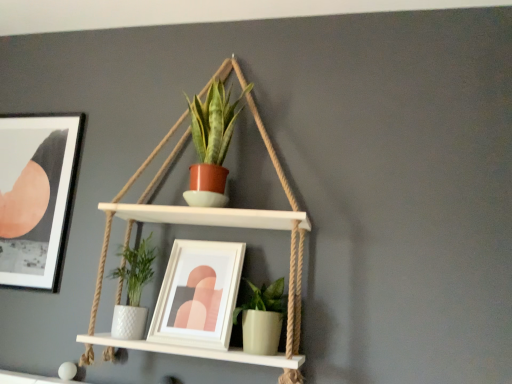
This screenshot has width=512, height=384. What are the coordinates of `matte terracotta pot at center, placed as the 2th houseplant when sorted from bottom to top` in the screenshot? It's located at (211, 145).

You are a GUI agent. You are given a task and a screenshot of the screen. Output one action in this format:
    pyautogui.click(x=<x>, y=<y>)
    Task: Click on the white matte picture frame at center, which is counted as the first picture frame, starting from the right
    Image resolution: width=512 pixels, height=384 pixels.
    Given the screenshot: What is the action you would take?
    pyautogui.click(x=198, y=294)

Is white matte picture frame at center, the second picture frame from the left, facing away from matte terracotta pot at center, the 1th houseplant in the top-to-bottom sequence?

No, white matte picture frame at center, the second picture frame from the left, is not facing the opposite direction of matte terracotta pot at center, the 1th houseplant in the top-to-bottom sequence.

From the image's perspective, does white matte picture frame at center, which is counted as the 1th picture frame, starting from the front, appear lower than matte terracotta pot at center, the 1th houseplant in the top-to-bottom sequence?

Indeed, from the image's perspective, white matte picture frame at center, which is counted as the 1th picture frame, starting from the front, is shown beneath matte terracotta pot at center, the 1th houseplant in the top-to-bottom sequence.

Considering the relative sizes of white matte picture frame at center, the second picture frame from the left, and matte terracotta pot at center, the 1th houseplant in the top-to-bottom sequence, in the image provided, is white matte picture frame at center, the second picture frame from the left, wider than matte terracotta pot at center, the 1th houseplant in the top-to-bottom sequence,?

Yes, white matte picture frame at center, the second picture frame from the left, is wider than matte terracotta pot at center, the 1th houseplant in the top-to-bottom sequence.

From a real-world perspective, between white matte picture frame at center, the second picture frame from the left, and matte terracotta pot at center, the 1th houseplant in the top-to-bottom sequence, who is vertically lower?

From a 3D spatial view, white matte picture frame at center, the second picture frame from the left, is below.

Does green matte pot at lower center, the second houseplant viewed from the top, have a lesser width compared to white matte picture frame at center, the second picture frame from the left?

Yes, green matte pot at lower center, the second houseplant viewed from the top, is thinner than white matte picture frame at center, the second picture frame from the left.

From the image's perspective, is green matte pot at lower center, the second houseplant viewed from the top, above white matte picture frame at center, marked as the second picture frame in a back-to-front arrangement?

No, from the image's perspective, green matte pot at lower center, the second houseplant viewed from the top, is not above white matte picture frame at center, marked as the second picture frame in a back-to-front arrangement.

How many degrees apart are the facing directions of green matte pot at lower center, which ranks as the 1th houseplant in bottom-to-top order, and white matte picture frame at center, which is counted as the first picture frame, starting from the right?

They differ by 0.127 degrees in their facing directions.

Is green matte pot at lower center, the second houseplant viewed from the top, not near white matte picture frame at center, which is counted as the 1th picture frame, starting from the front?

green matte pot at lower center, the second houseplant viewed from the top, is actually quite close to white matte picture frame at center, which is counted as the 1th picture frame, starting from the front.

Can you tell me how much white matte picture frame at center, the second picture frame from the left, and matte black picture frame at upper left, placed as the second picture frame when sorted from front to back, differ in facing direction?

1.1 degrees separate the facing orientations of white matte picture frame at center, the second picture frame from the left, and matte black picture frame at upper left, placed as the second picture frame when sorted from front to back.

Which is further, (x=226, y=331) or (x=47, y=200)?

The point (x=47, y=200) is farther.

Is white matte picture frame at center, marked as the second picture frame in a back-to-front arrangement, not near matte black picture frame at upper left, acting as the 1th picture frame starting from the back?

That's not correct — white matte picture frame at center, marked as the second picture frame in a back-to-front arrangement, is a little close to matte black picture frame at upper left, acting as the 1th picture frame starting from the back.

Is white matte picture frame at center, the second picture frame from the left, wider than matte black picture frame at upper left, acting as the 1th picture frame starting from the back?

Correct, the width of white matte picture frame at center, the second picture frame from the left, exceeds that of matte black picture frame at upper left, acting as the 1th picture frame starting from the back.

How many degrees apart are the facing directions of matte terracotta pot at center, placed as the 2th houseplant when sorted from bottom to top, and white matte picture frame at center, marked as the second picture frame in a back-to-front arrangement?

0.482 degrees.

From the image's perspective, is matte terracotta pot at center, the 1th houseplant in the top-to-bottom sequence, under white matte picture frame at center, the second picture frame from the left?

No, from the image's perspective, matte terracotta pot at center, the 1th houseplant in the top-to-bottom sequence, is not below white matte picture frame at center, the second picture frame from the left.

Looking at this image, which point is more distant from viewer, (x=193, y=139) or (x=191, y=323)?

Positioned behind is point (x=193, y=139).

Does matte terracotta pot at center, the 1th houseplant in the top-to-bottom sequence, contain white matte picture frame at center, marked as the second picture frame in a back-to-front arrangement?

No, matte terracotta pot at center, the 1th houseplant in the top-to-bottom sequence, does not contain white matte picture frame at center, marked as the second picture frame in a back-to-front arrangement.

Between matte black picture frame at upper left, acting as the 1th picture frame starting from the back, and white matte picture frame at center, marked as the second picture frame in a back-to-front arrangement, which one is positioned behind?

matte black picture frame at upper left, acting as the 1th picture frame starting from the back, is more distant.

Based on the photo, measure the distance from matte black picture frame at upper left, acting as the 1th picture frame starting from the back, to white matte picture frame at center, which is counted as the first picture frame, starting from the right.

25.82 inches.

Looking at this image, which is closer to the camera, (x=39, y=263) or (x=164, y=315)?

Point (x=39, y=263) is positioned farther from the camera compared to point (x=164, y=315).

Between matte black picture frame at upper left, acting as the 1th picture frame starting from the back, and white matte picture frame at center, marked as the second picture frame in a back-to-front arrangement, which one has smaller width?

With smaller width is matte black picture frame at upper left, acting as the 1th picture frame starting from the back.

Would you say matte black picture frame at upper left, placed as the second picture frame when sorted from front to back, is inside or outside matte terracotta pot at center, placed as the 2th houseplant when sorted from bottom to top?

matte black picture frame at upper left, placed as the second picture frame when sorted from front to back, is spatially situated outside matte terracotta pot at center, placed as the 2th houseplant when sorted from bottom to top.

Does matte black picture frame at upper left, acting as the 1th picture frame starting from the back, appear on the right side of matte terracotta pot at center, the 1th houseplant in the top-to-bottom sequence?

Incorrect, matte black picture frame at upper left, acting as the 1th picture frame starting from the back, is not on the right side of matte terracotta pot at center, the 1th houseplant in the top-to-bottom sequence.

Considering the relative positions of matte black picture frame at upper left, which ranks as the 1th picture frame in left-to-right order, and matte terracotta pot at center, placed as the 2th houseplant when sorted from bottom to top, in the image provided, is matte black picture frame at upper left, which ranks as the 1th picture frame in left-to-right order, behind matte terracotta pot at center, placed as the 2th houseplant when sorted from bottom to top,?

Yes, matte black picture frame at upper left, which ranks as the 1th picture frame in left-to-right order, is further from the viewer.

Is the surface of green matte pot at lower center, which ranks as the 1th houseplant in bottom-to-top order, in direct contact with matte terracotta pot at center, the 1th houseplant in the top-to-bottom sequence?

No, green matte pot at lower center, which ranks as the 1th houseplant in bottom-to-top order, is not with matte terracotta pot at center, the 1th houseplant in the top-to-bottom sequence.

Would you say green matte pot at lower center, the second houseplant viewed from the top, is outside matte terracotta pot at center, the 1th houseplant in the top-to-bottom sequence?

Yes, green matte pot at lower center, the second houseplant viewed from the top, is not within matte terracotta pot at center, the 1th houseplant in the top-to-bottom sequence.

How distant is green matte pot at lower center, which ranks as the 1th houseplant in bottom-to-top order, from matte terracotta pot at center, the 1th houseplant in the top-to-bottom sequence?

The distance of green matte pot at lower center, which ranks as the 1th houseplant in bottom-to-top order, from matte terracotta pot at center, the 1th houseplant in the top-to-bottom sequence, is 17.99 inches.

Which picture frame is the 1st one when counting from the left side of the matte terracotta pot at center, placed as the 2th houseplant when sorted from bottom to top? Please provide its 2D coordinates.

[(198, 294)]

Find the location of `houseplant that appears in front of the white matte picture frame at center, the second picture frame from the left`. houseplant that appears in front of the white matte picture frame at center, the second picture frame from the left is located at coordinates (262, 317).

Which object lies nearer to the anchor point white matte picture frame at center, which is counted as the 1th picture frame, starting from the front, matte black picture frame at upper left, placed as the second picture frame when sorted from front to back, or matte terracotta pot at center, placed as the 2th houseplant when sorted from bottom to top?

Based on the image, matte terracotta pot at center, placed as the 2th houseplant when sorted from bottom to top, appears to be nearer to white matte picture frame at center, which is counted as the 1th picture frame, starting from the front.

From the image, which object appears to be farther from green matte pot at lower center, which ranks as the 1th houseplant in bottom-to-top order, white matte picture frame at center, the second picture frame from the left, or matte black picture frame at upper left, which is the 2th picture frame in right-to-left order?

matte black picture frame at upper left, which is the 2th picture frame in right-to-left order, is positioned further to the anchor green matte pot at lower center, which ranks as the 1th houseplant in bottom-to-top order.

Looking at the image, which one is located further to green matte pot at lower center, which ranks as the 1th houseplant in bottom-to-top order, matte terracotta pot at center, placed as the 2th houseplant when sorted from bottom to top, or white matte picture frame at center, which is counted as the 1th picture frame, starting from the front?

Based on the image, matte terracotta pot at center, placed as the 2th houseplant when sorted from bottom to top, appears to be further to green matte pot at lower center, which ranks as the 1th houseplant in bottom-to-top order.

Looking at the image, which one is located further to green matte pot at lower center, which ranks as the 1th houseplant in bottom-to-top order, matte terracotta pot at center, the 1th houseplant in the top-to-bottom sequence, or matte black picture frame at upper left, which is the 2th picture frame in right-to-left order?

matte black picture frame at upper left, which is the 2th picture frame in right-to-left order.

Looking at the image, which one is located further to matte black picture frame at upper left, which is the 2th picture frame in right-to-left order, white matte picture frame at center, marked as the second picture frame in a back-to-front arrangement, or green matte pot at lower center, which ranks as the 1th houseplant in bottom-to-top order?

green matte pot at lower center, which ranks as the 1th houseplant in bottom-to-top order.

Considering their positions, is white matte picture frame at center, which is counted as the first picture frame, starting from the right, positioned further to green matte pot at lower center, which ranks as the 1th houseplant in bottom-to-top order, than matte terracotta pot at center, the 1th houseplant in the top-to-bottom sequence?

matte terracotta pot at center, the 1th houseplant in the top-to-bottom sequence, is positioned further to the anchor green matte pot at lower center, which ranks as the 1th houseplant in bottom-to-top order.

Based on the photo, estimate the real-world distances between objects in this image. Which object is closer to matte terracotta pot at center, placed as the 2th houseplant when sorted from bottom to top, green matte pot at lower center, the second houseplant viewed from the top, or matte black picture frame at upper left, which is the 2th picture frame in right-to-left order?

green matte pot at lower center, the second houseplant viewed from the top, is positioned closer to the anchor matte terracotta pot at center, placed as the 2th houseplant when sorted from bottom to top.

When comparing their distances from white matte picture frame at center, the second picture frame from the left, does matte terracotta pot at center, the 1th houseplant in the top-to-bottom sequence, or green matte pot at lower center, the second houseplant viewed from the top, seem further?

matte terracotta pot at center, the 1th houseplant in the top-to-bottom sequence, is positioned further to the anchor white matte picture frame at center, the second picture frame from the left.

I want to click on picture frame between matte black picture frame at upper left, which ranks as the 1th picture frame in left-to-right order, and matte terracotta pot at center, placed as the 2th houseplant when sorted from bottom to top, from left to right, so click(x=198, y=294).

Where is `picture frame between matte black picture frame at upper left, which is the 2th picture frame in right-to-left order, and green matte pot at lower center, which ranks as the 1th houseplant in bottom-to-top order`? Image resolution: width=512 pixels, height=384 pixels. picture frame between matte black picture frame at upper left, which is the 2th picture frame in right-to-left order, and green matte pot at lower center, which ranks as the 1th houseplant in bottom-to-top order is located at coordinates (198, 294).

At what (x,y) coordinates should I click in order to perform the action: click on houseplant located between matte black picture frame at upper left, which ranks as the 1th picture frame in left-to-right order, and green matte pot at lower center, the second houseplant viewed from the top, in the left-right direction. Please return your answer as a coordinate pair (x, y). This screenshot has width=512, height=384. Looking at the image, I should click on (211, 145).